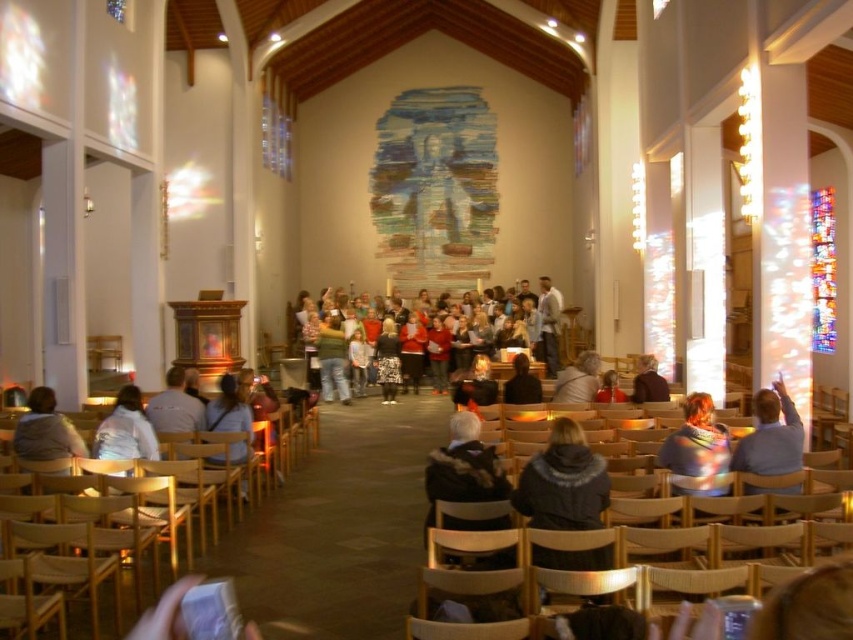
You are an event organizer setting up chairs for a small gathering. You need to place a chair where the multicolored fabric at center and the light gray sweater at lower left are currently located. Which object must you move first to make space for the chair?

You must move the light gray sweater at lower left first because the multicolored fabric at center is positioned over it, meaning the sweater is underneath and can be moved without disturbing the fabric above.

You are standing at the entrance of the church and want to find the light gray sweater at lower left. Which direction should you look to see it first before the multicolored fabric at center?

The light gray sweater at lower left is to the left of the multicolored fabric at center, so you should look to your left to see the light gray sweater at lower left first before the multicolored fabric at center.

You are standing at the entrance of the church and see the multicolored fabric at center and the light gray sweater at lower left. Which object is taller?

The multicolored fabric at center is much taller than the light gray sweater at lower left.